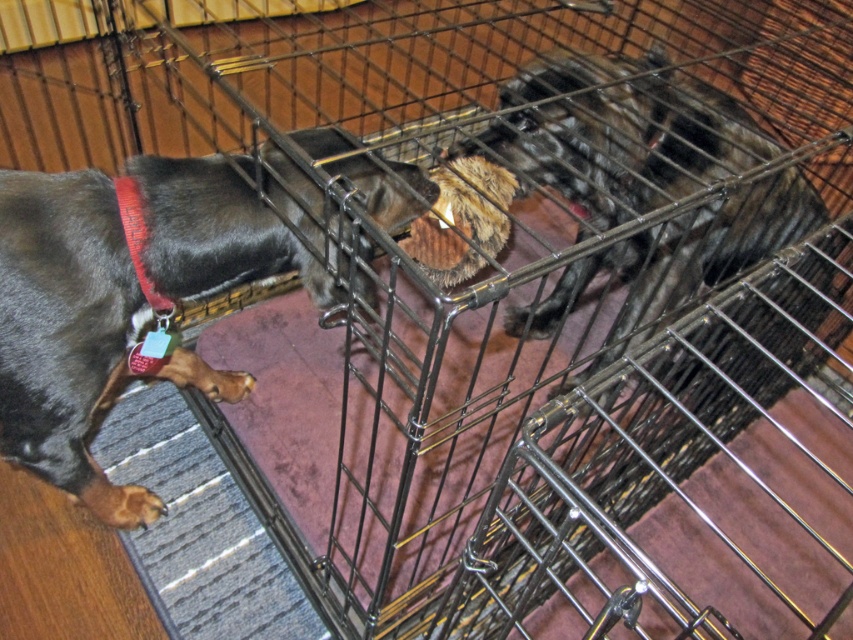
You are a veterinarian examining the cage setup. The red fabric collar at left is 10 cm in height. Can the black fur dog at center, which is taller than the collar, fit comfortably through the gaps in the metal cage bars?

The black fur dog at center has a greater height compared to the red fabric collar at left. Since the collar is 10 cm in height and the dog is taller, the gaps between the metal cage bars must be wider than 10 cm to allow the dog to move comfortably without getting stuck. However, without knowing the exact size of the gaps, it is difficult to confirm. Please check the cage bar spacing.

Consider the image. You are a pet owner who wants to feed both animals in the cage. The food bowl is placed exactly between the shiny black fur at left and the black fur dog at center. If the distance between them is 26.15 inches, can you estimate how far each animal is from the food bowl?

The food bowl is placed exactly between the shiny black fur at left and the black fur dog at center, which are 26.15 inches apart. Therefore, each animal would be approximately 13.075 inches away from the food bowl.

You are a visitor observing the cage from the front. Which animal, the shiny black fur at left or the black fur dog at center, is closer to you?

The shiny black fur at left is closer to you because it is further to the viewer than the black fur dog at center.